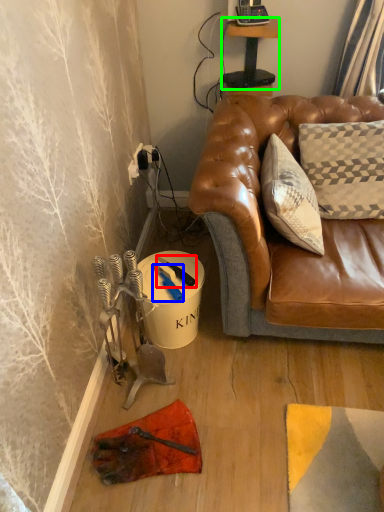
Question: Which object is positioned closest to tool (highlighted by a red box)? Select from tool (highlighted by a blue box) and table (highlighted by a green box).

Choices:
 (A) tool
 (B) table

Answer: (A)